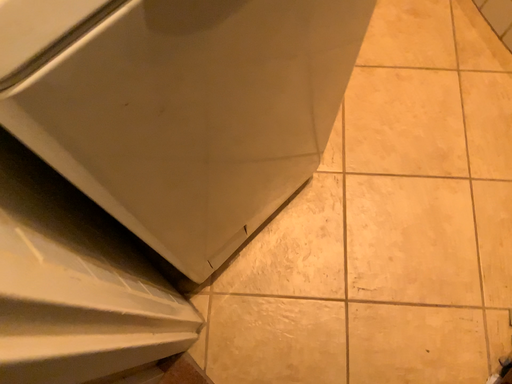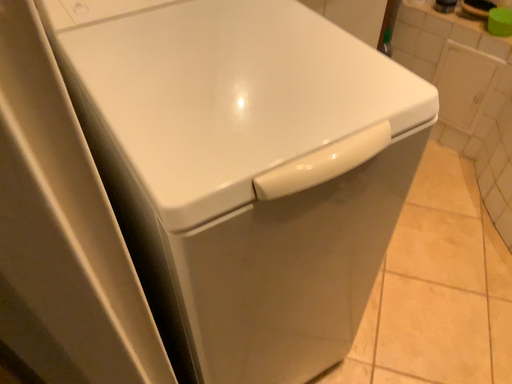
Question: Which way did the camera rotate in the video?

Choices:
 (A) rotated downward
 (B) rotated upward

Answer: (B)